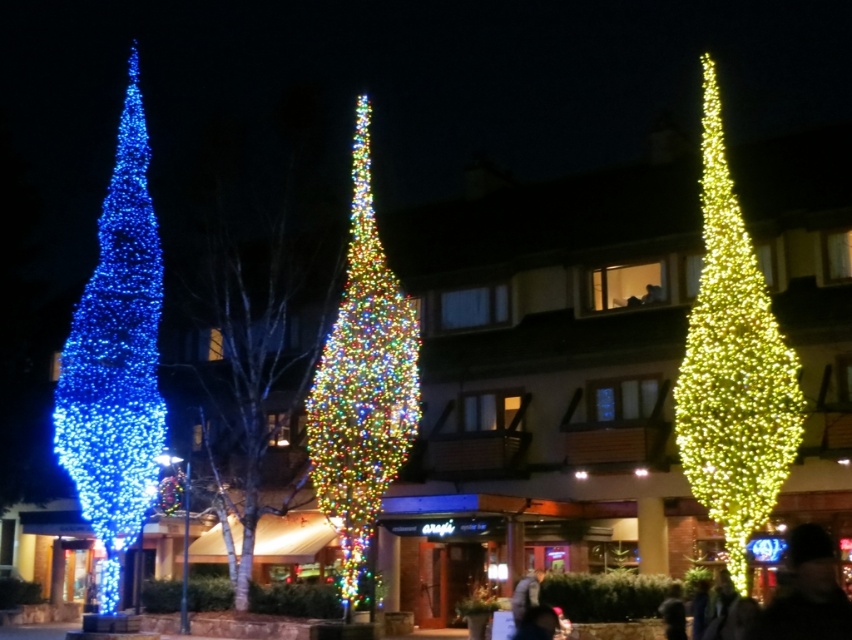
Which is more to the right, blue glossy christmas tree at left or multicolored lights at center?

Positioned to the right is multicolored lights at center.

Who is lower down, blue glossy christmas tree at left or multicolored lights at center?

blue glossy christmas tree at left

Describe the element at coordinates (116, 360) in the screenshot. I see `blue glossy christmas tree at left` at that location.

Where is `blue glossy christmas tree at left`? blue glossy christmas tree at left is located at coordinates (116, 360).

Can you confirm if blue glossy christmas tree at left is thinner than blue glittering lights at left?

In fact, blue glossy christmas tree at left might be wider than blue glittering lights at left.

Is blue glossy christmas tree at left bigger than blue glittering lights at left?

Indeed, blue glossy christmas tree at left has a larger size compared to blue glittering lights at left.

Who is more distant from viewer, (130, 314) or (252, 358)?

The point (252, 358) is more distant.

At what (x,y) coordinates should I click in order to perform the action: click on blue glossy christmas tree at left. Please return your answer as a coordinate pair (x, y). Looking at the image, I should click on (116, 360).

From the picture: Is shiny gold christmas tree at right thinner than multicolored lights at center?

No.

Which is above, shiny gold christmas tree at right or multicolored lights at center?

shiny gold christmas tree at right is above.

Is point (682, 460) less distant than point (401, 440)?

No, (682, 460) is behind (401, 440).

Find the location of `shiny gold christmas tree at right`. shiny gold christmas tree at right is located at coordinates (734, 365).